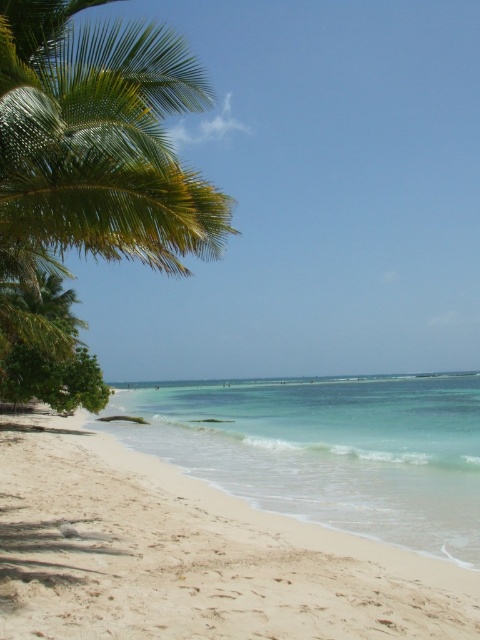
You are a person who is 1.7 meters tall. You are standing on the white sandy beach at lower left and want to walk to the green leafy palm tree at left. How many steps would you need to take to reach it?

The distance between the white sandy beach at lower left and the green leafy palm tree at left is 6.19 meters. Assuming an average step length of about 0.76 meters, you would need approximately 8 steps to reach the tree.